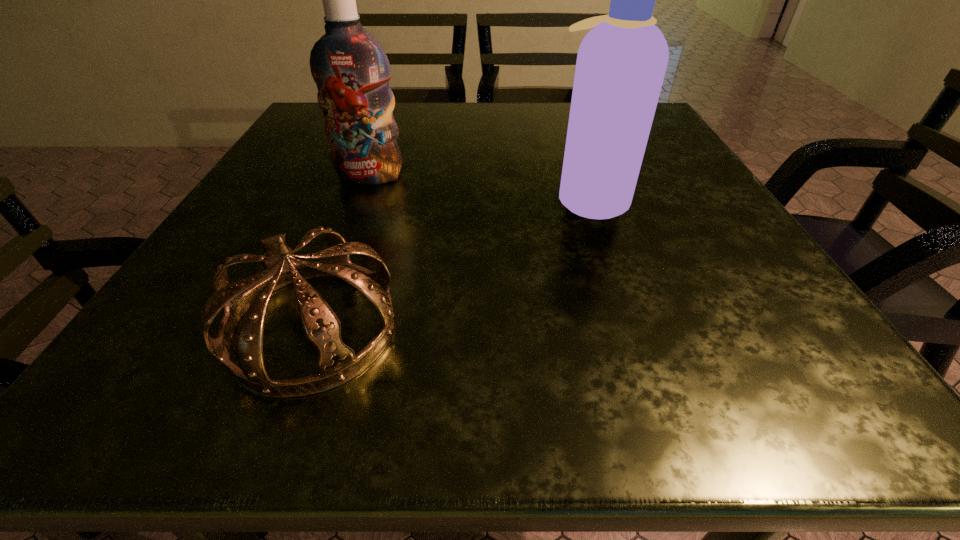
Where is `free spot between the nearest object and the rightmost object`? Image resolution: width=960 pixels, height=540 pixels. free spot between the nearest object and the rightmost object is located at coordinates (451, 263).

The height and width of the screenshot is (540, 960). I want to click on object that is the second closest to the rightmost object, so click(351, 70).

Identify the location of object that is the second closest to the nearest object. The height and width of the screenshot is (540, 960). (621, 63).

Find the location of a particular element. The image size is (960, 540). free space that satisfies the following two spatial constraints: 1. on the front label of the left shampoo; 2. on the left side of the rightmost object is located at coordinates (362, 198).

Where is `vacant space that satisfies the following two spatial constraints: 1. on the front label of the right shampoo; 2. on the left side of the left shampoo`? This screenshot has width=960, height=540. vacant space that satisfies the following two spatial constraints: 1. on the front label of the right shampoo; 2. on the left side of the left shampoo is located at coordinates (362, 198).

Locate an element on the screen. This screenshot has height=540, width=960. free space that satisfies the following two spatial constraints: 1. on the front label of the left shampoo; 2. on the right side of the right shampoo is located at coordinates (362, 198).

Where is `free region that satisfies the following two spatial constraints: 1. on the back side of the nearest object; 2. on the left side of the rightmost object`? This screenshot has width=960, height=540. free region that satisfies the following two spatial constraints: 1. on the back side of the nearest object; 2. on the left side of the rightmost object is located at coordinates (361, 198).

Locate an element on the screen. The height and width of the screenshot is (540, 960). vacant space that satisfies the following two spatial constraints: 1. on the front label of the left shampoo; 2. on the right side of the right shampoo is located at coordinates (362, 198).